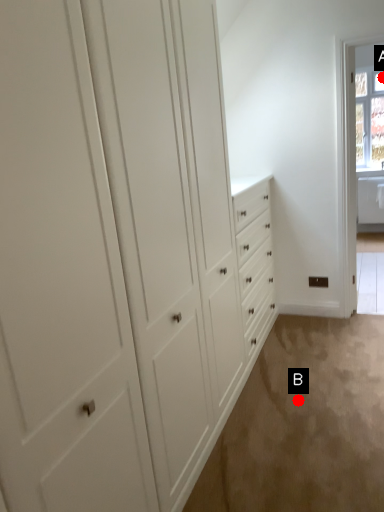
Question: Two points are circled on the image, labeled by A and B beside each circle. Which of the following is the farthest from the observer?

Choices:
 (A) A is further
 (B) B is further

Answer: (A)